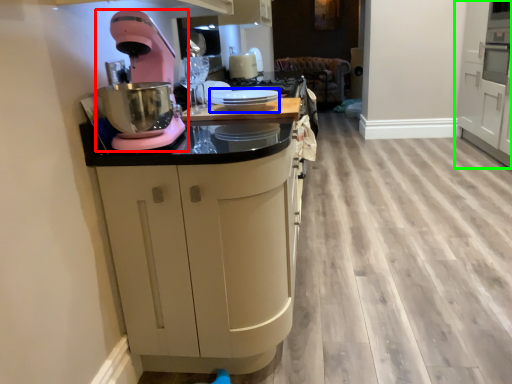
Question: Which is nearer to the home appliance (highlighted by a red box)? appliance (highlighted by a blue box) or cabinetry (highlighted by a green box).

Choices:
 (A) appliance
 (B) cabinetry

Answer: (A)